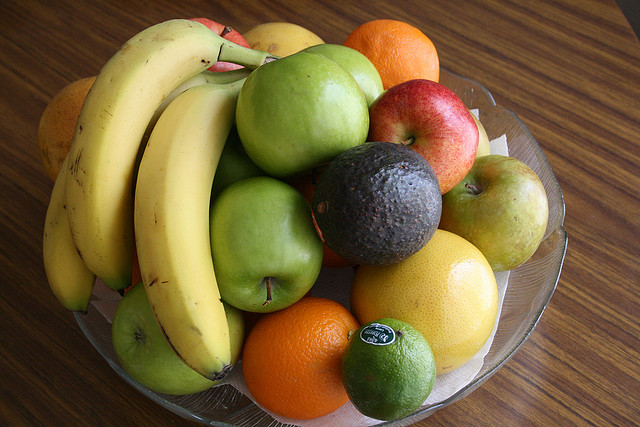
The image size is (640, 427). I want to click on wooden table, so click(x=578, y=147).